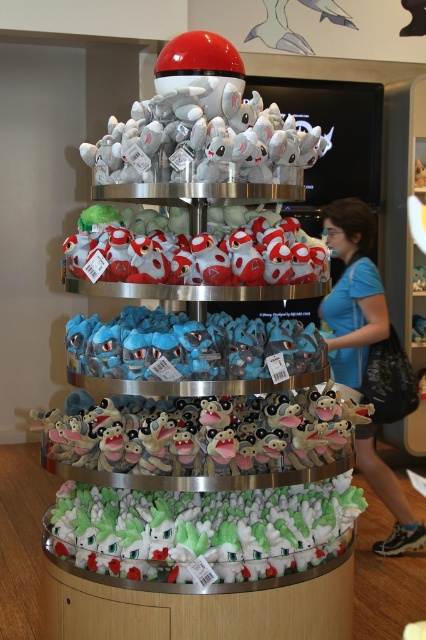
Question: Is the position of white plush toys at center more distant than that of fluffy plush monkey at center?

Choices:
 (A) no
 (B) yes

Answer: (A)

Question: Among these points, which one is nearest to the camera?

Choices:
 (A) (368, 433)
 (B) (221, 365)

Answer: (B)

Question: Estimate the real-world distances between objects in this image. Which object is farther from the fluffy plush monkey at center?

Choices:
 (A) white soft plushies at bottom
 (B) white plush toy at upper center
 (C) blue plush toy at center
 (D) blue fabric shirt at center

Answer: (D)

Question: Can you confirm if white plush toys at center is positioned above blue plush toy at center?

Choices:
 (A) yes
 (B) no

Answer: (A)

Question: Does white soft plushies at bottom appear on the right side of soft plush toy at center?

Choices:
 (A) yes
 (B) no

Answer: (A)

Question: Considering the real-world distances, which object is closest to the white soft plushies at bottom?

Choices:
 (A) fluffy plush monkey at center
 (B) white plush toys at center
 (C) white plush toy at upper center
 (D) blue fabric shirt at center

Answer: (A)